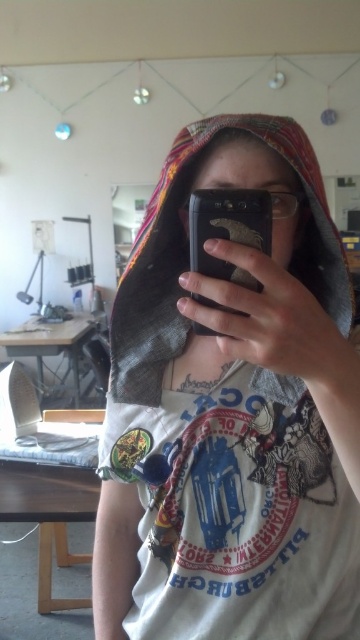
Question: Among these points, which one is nearest to the camera?

Choices:
 (A) (259, 436)
 (B) (196, 333)

Answer: (B)

Question: Does denim jacket at center appear on the right side of black matte smartphone at center?

Choices:
 (A) no
 (B) yes

Answer: (A)

Question: Among these objects, which one is farthest from the camera?

Choices:
 (A) denim jacket at center
 (B) black matte smartphone at center

Answer: (B)

Question: Can you confirm if denim jacket at center is thinner than black matte smartphone at center?

Choices:
 (A) yes
 (B) no

Answer: (B)

Question: Does denim jacket at center come in front of black matte smartphone at center?

Choices:
 (A) yes
 (B) no

Answer: (A)